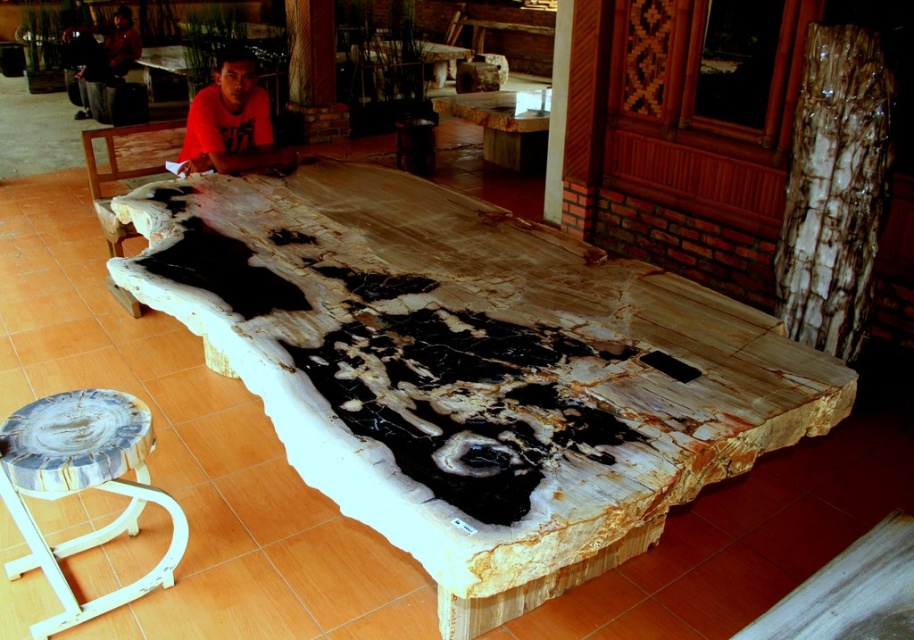
Question: Does matte orange shirt at center appear under dark brown leather jacket at upper left?

Choices:
 (A) no
 (B) yes

Answer: (B)

Question: Which point appears farthest from the camera in this image?

Choices:
 (A) (236, 108)
 (B) (137, 42)
 (C) (615, 280)
 (D) (94, 483)

Answer: (B)

Question: Is black and white marble table at center closer to the viewer compared to polished wood table at center?

Choices:
 (A) yes
 (B) no

Answer: (A)

Question: Among these points, which one is nearest to the camera?

Choices:
 (A) (250, 113)
 (B) (484, 236)
 (C) (128, 452)

Answer: (C)

Question: Which of these objects is positioned farthest from the natural wood stool at lower left?

Choices:
 (A) black and white marble table at center
 (B) dark brown leather jacket at upper left

Answer: (B)

Question: Observing the image, what is the correct spatial positioning of black and white marble table at center in reference to natural wood stool at lower left?

Choices:
 (A) below
 (B) above

Answer: (B)